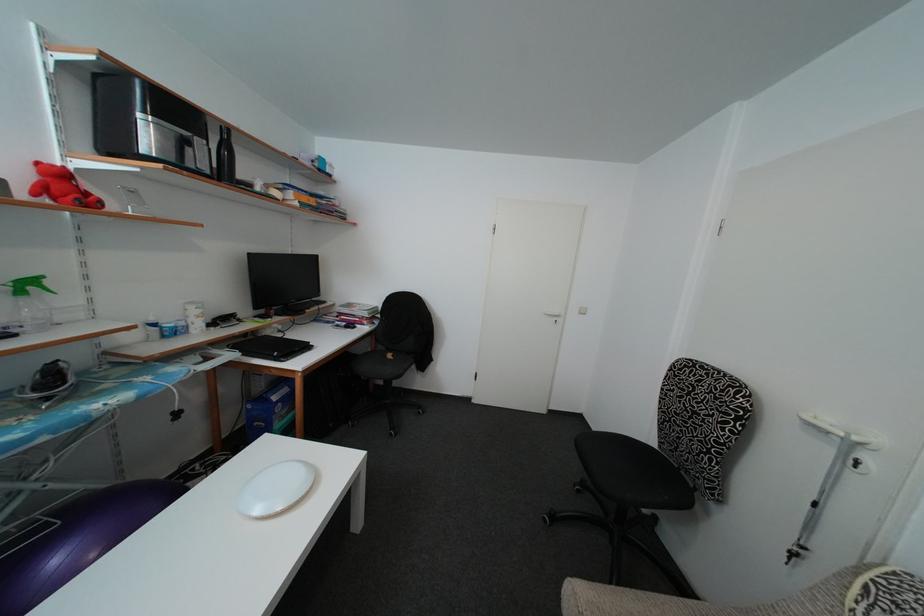
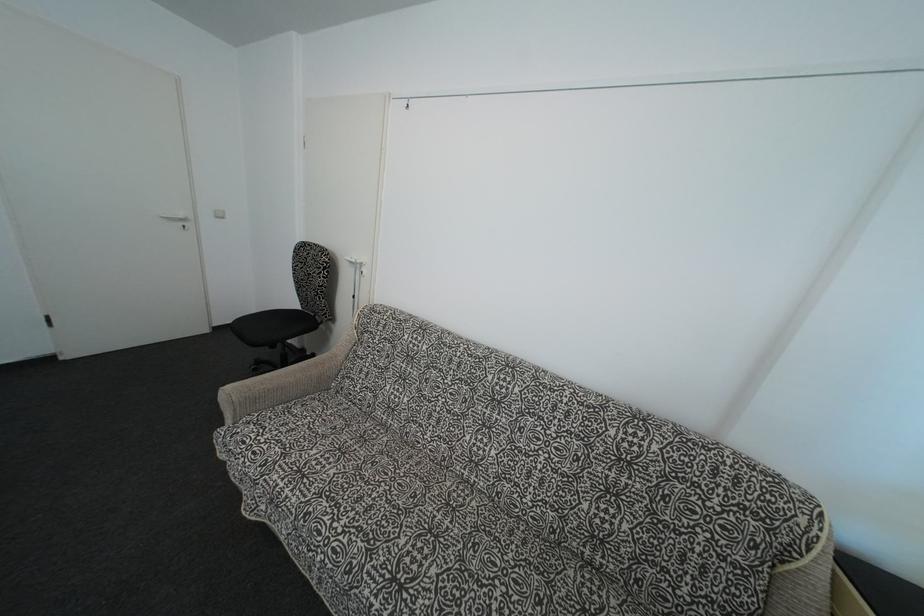
Locate, in the second image, the point that corresponds to [650,440] in the first image.

(297, 310)